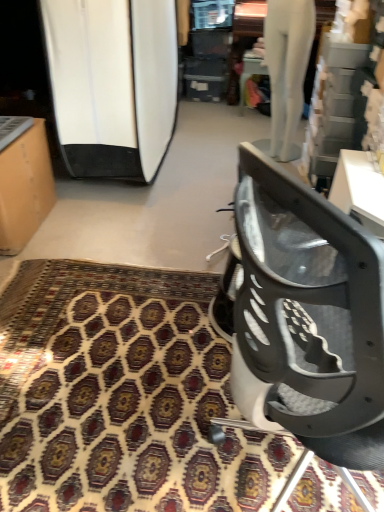
Question: Is matte cardboard box at left oriented away from patterned carpet at center?

Choices:
 (A) yes
 (B) no

Answer: (B)

Question: From a real-world perspective, is matte cardboard box at left physically above patterned carpet at center?

Choices:
 (A) yes
 (B) no

Answer: (A)

Question: Is matte cardboard box at left shorter than patterned carpet at center?

Choices:
 (A) no
 (B) yes

Answer: (A)

Question: Is matte cardboard box at left behind patterned carpet at center?

Choices:
 (A) yes
 (B) no

Answer: (A)

Question: Is matte cardboard box at left thinner than patterned carpet at center?

Choices:
 (A) yes
 (B) no

Answer: (A)

Question: Does matte cardboard box at left lie in front of patterned carpet at center?

Choices:
 (A) no
 (B) yes

Answer: (A)

Question: Are metallic gray chair at lower right and white glossy surfboard at left located far from each other?

Choices:
 (A) no
 (B) yes

Answer: (B)

Question: Considering the relative positions of metallic gray chair at lower right and white glossy surfboard at left in the image provided, is metallic gray chair at lower right to the right of white glossy surfboard at left from the viewer's perspective?

Choices:
 (A) yes
 (B) no

Answer: (A)

Question: Considering the relative sizes of metallic gray chair at lower right and white glossy surfboard at left in the image provided, is metallic gray chair at lower right bigger than white glossy surfboard at left?

Choices:
 (A) yes
 (B) no

Answer: (B)

Question: From the image's perspective, is metallic gray chair at lower right under white glossy surfboard at left?

Choices:
 (A) yes
 (B) no

Answer: (A)

Question: From a real-world perspective, is metallic gray chair at lower right below white glossy surfboard at left?

Choices:
 (A) yes
 (B) no

Answer: (A)

Question: Can you confirm if metallic gray chair at lower right is taller than white glossy surfboard at left?

Choices:
 (A) no
 (B) yes

Answer: (A)

Question: Is the position of matte cardboard box at left more distant than that of metallic gray chair at lower right?

Choices:
 (A) no
 (B) yes

Answer: (B)